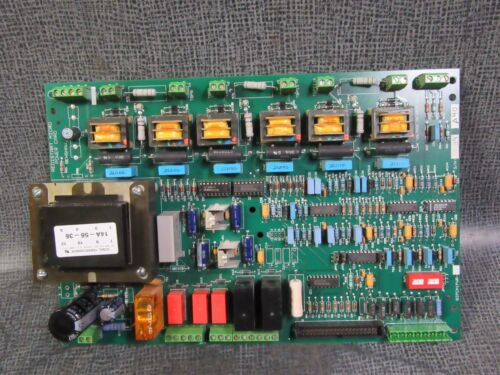
Where is `cushion`? The image size is (500, 375). cushion is located at coordinates (370, 38), (478, 329).